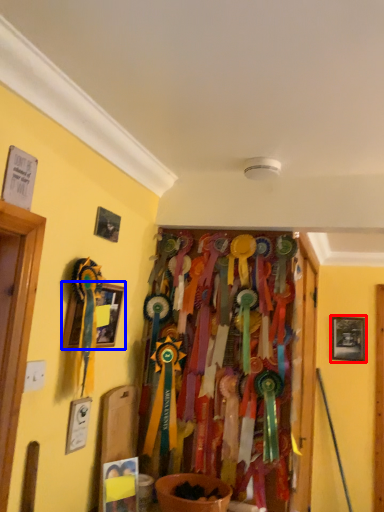
Question: Which object appears farthest to the camera in this image, picture frame (highlighted by a red box) or picture frame (highlighted by a blue box)?

Choices:
 (A) picture frame
 (B) picture frame

Answer: (A)